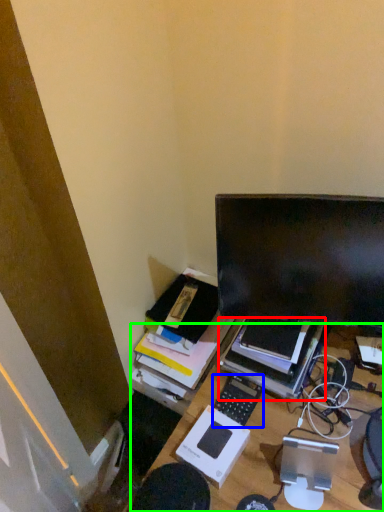
Question: Which is farther away from computer (highlighted by a red box)? computer keyboard (highlighted by a blue box) or desk (highlighted by a green box)?

Choices:
 (A) computer keyboard
 (B) desk

Answer: (B)